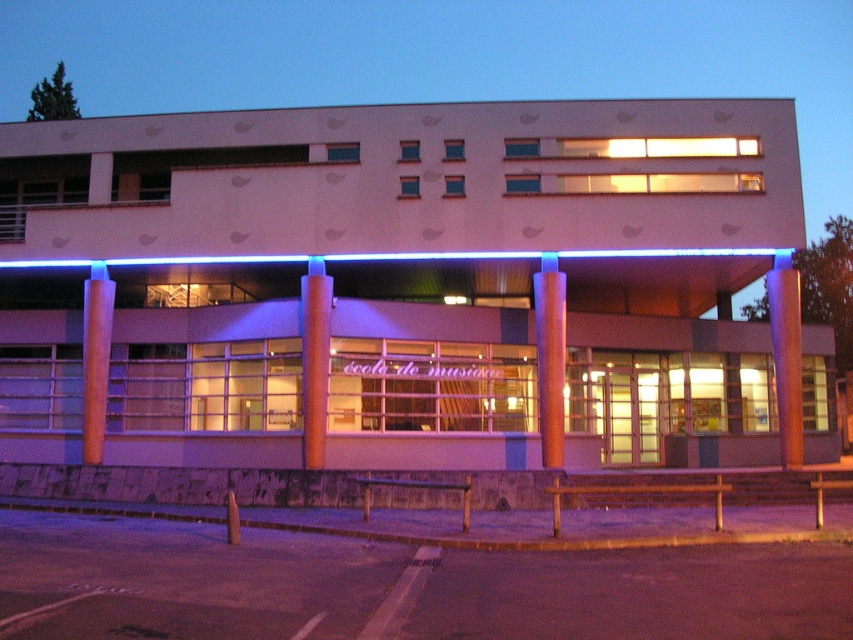
Question: Can you confirm if orange glossy pillar at right is positioned above brown polished wood pillar at left?

Choices:
 (A) no
 (B) yes

Answer: (A)

Question: Estimate the real-world distances between objects in this image. Which object is farther from the smooth wood pillar at center?

Choices:
 (A) brown polished wood pillar at left
 (B) orange glossy pillar at right
 (C) orange textured pillar at center

Answer: (A)

Question: Can you confirm if smooth wood pillar at center is thinner than brown polished wood pillar at left?

Choices:
 (A) yes
 (B) no

Answer: (A)

Question: Which point is farther to the camera?

Choices:
 (A) smooth wood pillar at center
 (B) orange textured pillar at center
 (C) brown polished wood pillar at left

Answer: (C)

Question: Does smooth wood pillar at center have a larger size compared to brown polished wood pillar at left?

Choices:
 (A) no
 (B) yes

Answer: (A)

Question: Which point is closer to the camera taking this photo?

Choices:
 (A) 306,403
 (B) 785,330

Answer: (A)